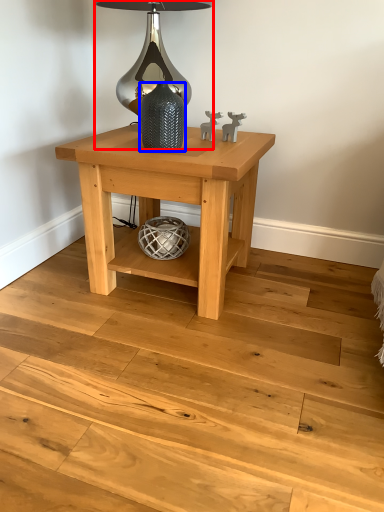
Question: Which point is further to the camera, table lamp (highlighted by a red box) or glass vase (highlighted by a blue box)?

Choices:
 (A) table lamp
 (B) glass vase

Answer: (A)